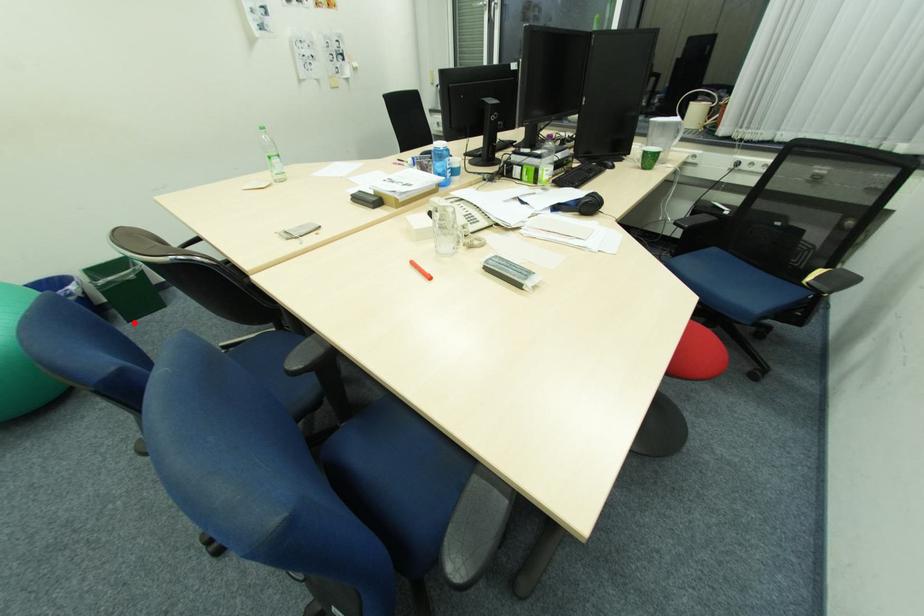
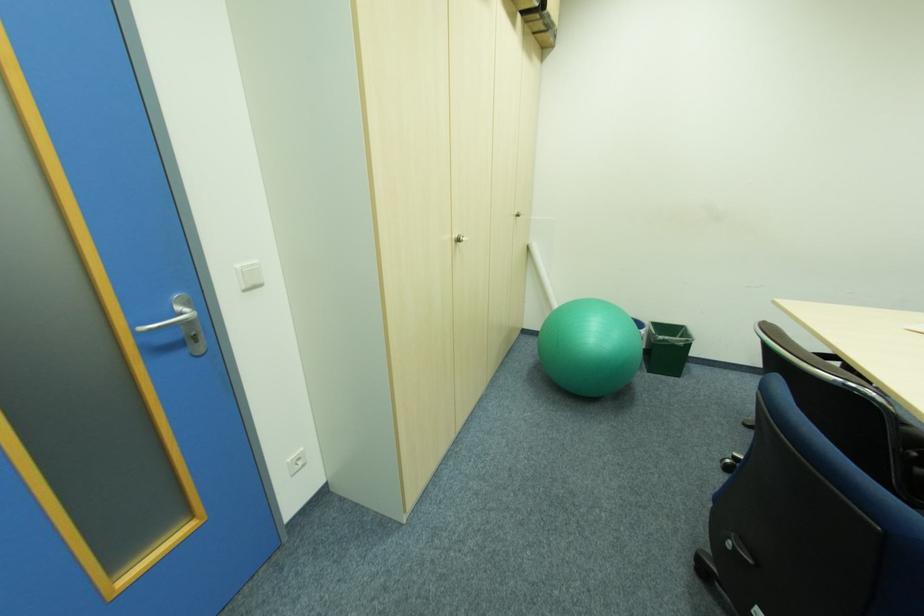
Where in the second image is the point corresponding to the highlighted location from the first image?

(653, 371)